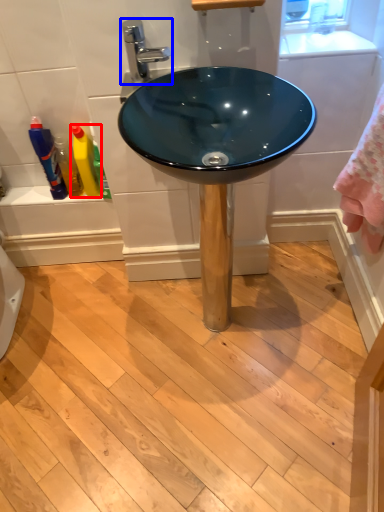
Question: Among these objects, which one is nearest to the camera, cleaning product (highlighted by a red box) or tap (highlighted by a blue box)?

Choices:
 (A) cleaning product
 (B) tap

Answer: (B)